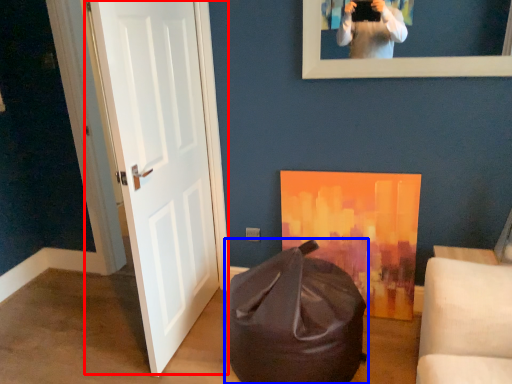
Question: Which object appears closest to the camera in this image, door (highlighted by a red box) or bean bag chair (highlighted by a blue box)?

Choices:
 (A) door
 (B) bean bag chair

Answer: (A)